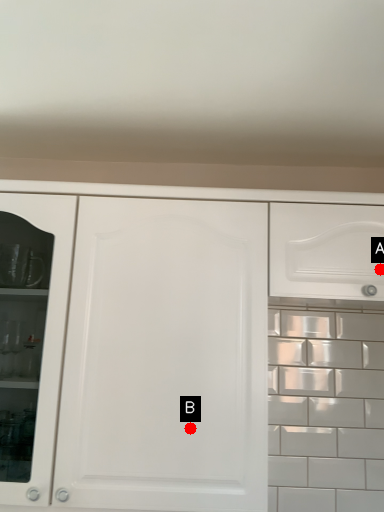
Question: Two points are circled on the image, labeled by A and B beside each circle. Which point is closer to the camera?

Choices:
 (A) A is closer
 (B) B is closer

Answer: (B)